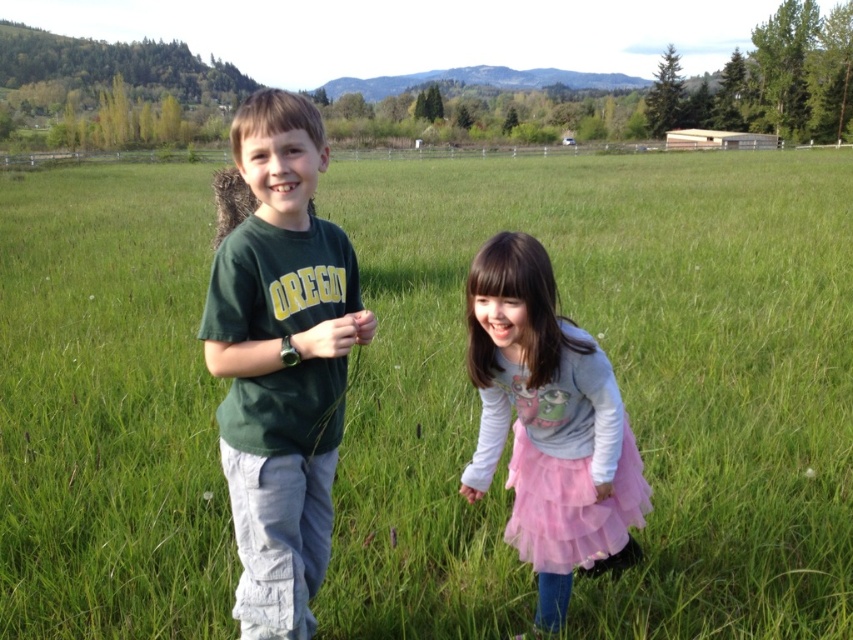
Describe the element at coordinates (548, 426) in the screenshot. Image resolution: width=853 pixels, height=640 pixels. I see `pink tulle skirt at center` at that location.

Who is more distant from viewer, (490, 240) or (572, 552)?

The point (572, 552) is more distant.

Is point (555, 540) in front of point (572, 547)?

Yes.

Where is `pink tulle skirt at center`? The image size is (853, 640). pink tulle skirt at center is located at coordinates (548, 426).

Does green cotton shirt at center have a smaller size compared to pink tulle skirt at center?

Yes, green cotton shirt at center is smaller than pink tulle skirt at center.

Does point (331, 244) lie in front of point (579, 406)?

Yes, it is.

Measure the distance between point (231,342) and camera.

Point (231,342) is 7.12 feet from camera.

Where is `green cotton shirt at center`? Image resolution: width=853 pixels, height=640 pixels. green cotton shirt at center is located at coordinates (281, 362).

Which of these two, green cotton shirt at center or pink tulle skirt at lower center, stands taller?

green cotton shirt at center is taller.

Is green cotton shirt at center closer to the viewer compared to pink tulle skirt at lower center?

Yes, green cotton shirt at center is closer to the viewer.

You are a GUI agent. You are given a task and a screenshot of the screen. Output one action in this format:
    pyautogui.click(x=<x>, y=<y>)
    Task: Click on the green cotton shirt at center
    The height and width of the screenshot is (640, 853).
    Given the screenshot: What is the action you would take?
    pyautogui.click(x=281, y=362)